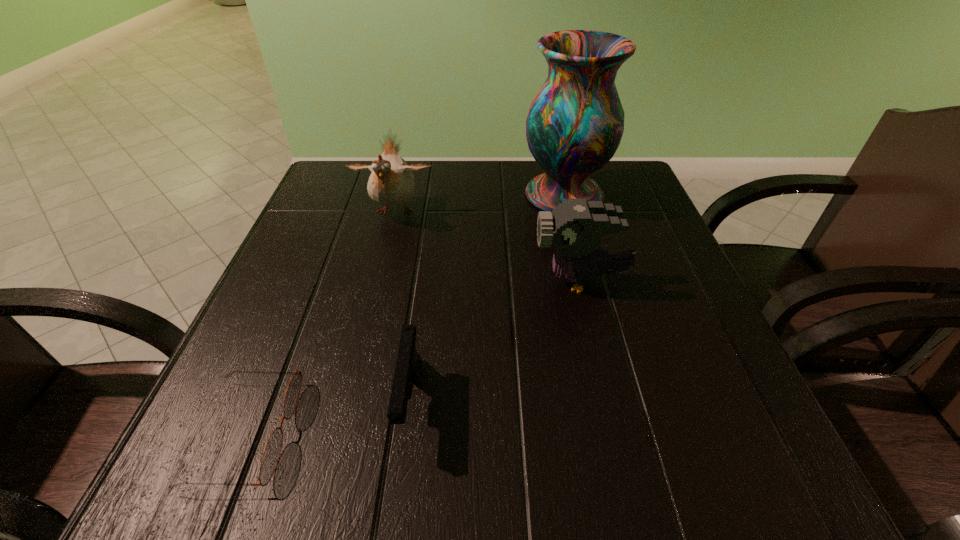
Find the location of a particular element. The width and height of the screenshot is (960, 540). bird that is at the right edge is located at coordinates (575, 228).

Where is `object at the far left corner`? This screenshot has height=540, width=960. object at the far left corner is located at coordinates (391, 183).

Where is `object that is at the near left corner`? This screenshot has height=540, width=960. object that is at the near left corner is located at coordinates (272, 451).

You are a GUI agent. You are given a task and a screenshot of the screen. Output one action in this format:
    pyautogui.click(x=<x>, y=<y>)
    Task: Click on the object that is positioned at the far right corner
    
    Given the screenshot: What is the action you would take?
    pyautogui.click(x=574, y=126)

This screenshot has height=540, width=960. Find the location of `vacant space at the far edge of the desktop`. vacant space at the far edge of the desktop is located at coordinates (456, 168).

Locate an element on the screen. free space at the near edge of the desktop is located at coordinates (622, 494).

The width and height of the screenshot is (960, 540). In the image, there is a desktop. In order to click on vacant region at the left edge in this screenshot , I will do `click(345, 233)`.

In the image, there is a desktop. Where is `free region at the right edge`? The width and height of the screenshot is (960, 540). free region at the right edge is located at coordinates (635, 272).

The image size is (960, 540). Identify the location of free location at the far left corner of the desktop. (330, 194).

Locate an element on the screen. The image size is (960, 540). vacant space at the near left corner of the desktop is located at coordinates (261, 441).